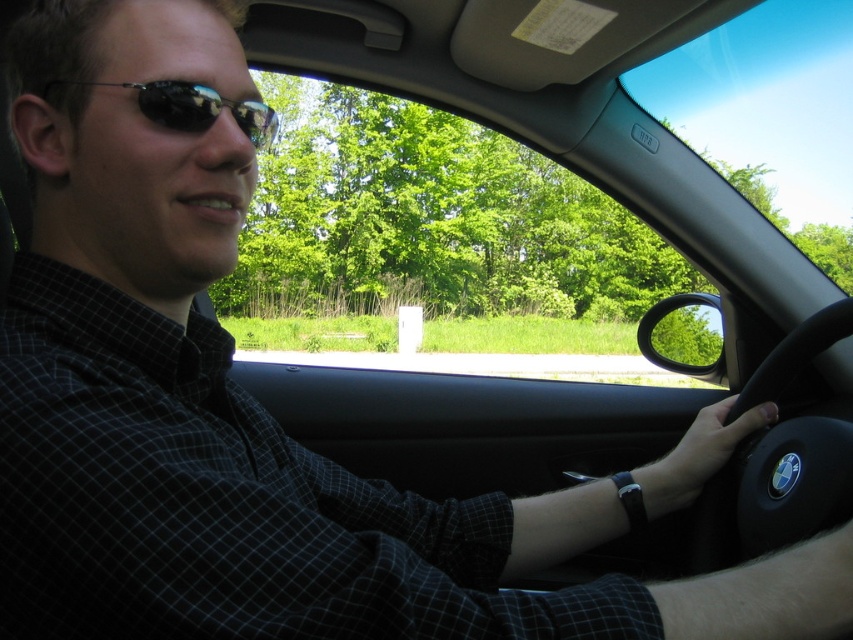
You are a passenger in the car and want to place your sunglasses on the dashboard. Given the space between the black leather steering wheel at lower right and the sunglasses at left, can you tell if there is enough room?

The black leather steering wheel at lower right is taller than the sunglasses at left, so there might be enough vertical space on the dashboard to place the sunglasses between them. However, the exact horizontal space isn

You need to place a GPS holder on the dashboard. The GPS requires a space wider than the sunglasses at left. Can the black leather steering wheel at lower right provide enough width for the GPS holder?

The black leather steering wheel at lower right might be wider than sunglasses at left, so it could potentially provide enough width for the GPS holder if the space is measured correctly.

You are a car designer who wants to install a new GPS device between the black leather steering wheel at lower right and the sunglasses at left. The GPS device requires a minimum of 100 centimeters of space. Do you think there is enough space?

The distance between the black leather steering wheel at lower right and the sunglasses at left is 80.72 centimeters, which is less than the required 100 centimeters. Therefore, there is not enough space to install the GPS device.